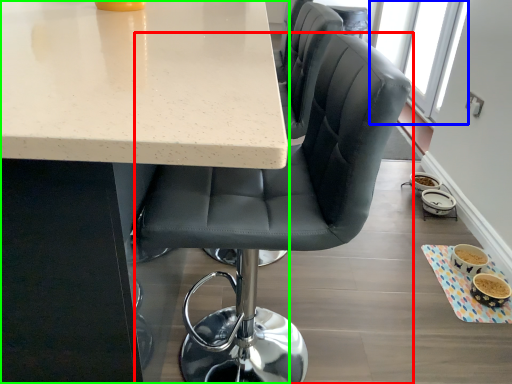
Question: Which is nearer to the chair (highlighted by a red box)? window screen (highlighted by a blue box) or table (highlighted by a green box).

Choices:
 (A) window screen
 (B) table

Answer: (B)